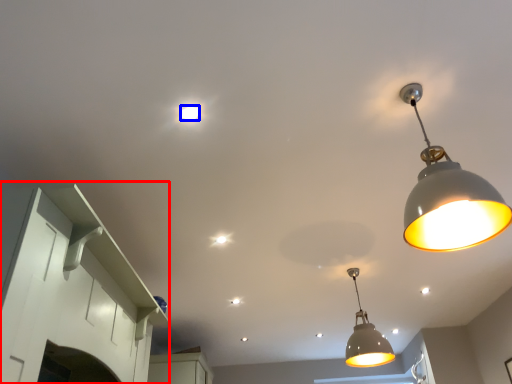
Question: Which object is closer to the camera taking this photo, cabinetry (highlighted by a red box) or light bulb (highlighted by a blue box)?

Choices:
 (A) cabinetry
 (B) light bulb

Answer: (A)